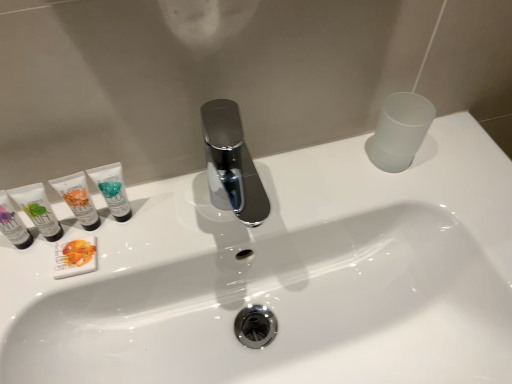
Question: Is white matte soap bar at left, the 3th toiletry from the left, turned away from matte white tube at left, the fifth toiletry in the right-to-left sequence?

Choices:
 (A) no
 (B) yes

Answer: (A)

Question: Does white matte soap bar at left, the third toiletry positioned from the right, appear on the right side of matte white tube at left, which is the 1th toiletry from left to right?

Choices:
 (A) yes
 (B) no

Answer: (A)

Question: Is white matte soap bar at left, the third toiletry positioned from the right, bigger than matte white tube at left, the fifth toiletry in the right-to-left sequence?

Choices:
 (A) yes
 (B) no

Answer: (B)

Question: Does white matte soap bar at left, the 3th toiletry from the left, contain matte white tube at left, the fifth toiletry in the right-to-left sequence?

Choices:
 (A) yes
 (B) no

Answer: (B)

Question: Is white matte soap bar at left, the third toiletry positioned from the right, positioned in front of matte white tube at left, the fifth toiletry in the right-to-left sequence?

Choices:
 (A) no
 (B) yes

Answer: (A)

Question: From a real-world perspective, is white glossy sink at center above or below white matte tube at left, the 4th toiletry positioned from the left?

Choices:
 (A) above
 (B) below

Answer: (B)

Question: From their relative heights in the image, would you say white glossy sink at center is taller or shorter than white matte tube at left, the second toiletry from the right?

Choices:
 (A) tall
 (B) short

Answer: (A)

Question: Is white glossy sink at center bigger or smaller than white matte tube at left, the second toiletry from the right?

Choices:
 (A) big
 (B) small

Answer: (A)

Question: Is white glossy sink at center to the left or to the right of white matte tube at left, the 4th toiletry positioned from the left, in the image?

Choices:
 (A) left
 (B) right

Answer: (B)

Question: From the image's perspective, is white matte tube at left, the second toiletry from the right, above or below teal matte tube at left, the first toiletry when ordered from right to left?

Choices:
 (A) above
 (B) below

Answer: (B)

Question: In terms of width, does white matte tube at left, the 4th toiletry positioned from the left, look wider or thinner when compared to teal matte tube at left, the first toiletry when ordered from right to left?

Choices:
 (A) thin
 (B) wide

Answer: (B)

Question: Considering their positions, is white matte tube at left, the 4th toiletry positioned from the left, located in front of or behind teal matte tube at left, the first toiletry when ordered from right to left?

Choices:
 (A) behind
 (B) front

Answer: (B)

Question: Considering the relative positions of white matte tube at left, the 4th toiletry positioned from the left, and teal matte tube at left, the first toiletry when ordered from right to left, in the image provided, is white matte tube at left, the 4th toiletry positioned from the left, to the left or to the right of teal matte tube at left, the first toiletry when ordered from right to left,?

Choices:
 (A) right
 (B) left

Answer: (B)

Question: From the image's perspective, relative to white matte soap bar at left, the 3th toiletry from the left, is matte white tube at left, the 4th toiletry from the right, above or below?

Choices:
 (A) above
 (B) below

Answer: (A)

Question: From their relative heights in the image, would you say matte white tube at left, which is counted as the second toiletry, starting from the left, is taller or shorter than white matte soap bar at left, the third toiletry positioned from the right?

Choices:
 (A) tall
 (B) short

Answer: (A)